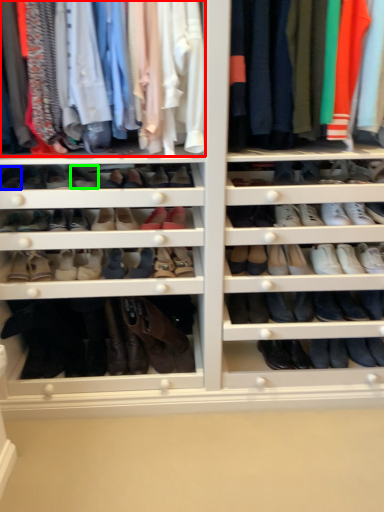
Question: Which is nearer to the clothing (highlighted by a red box)? shoe (highlighted by a blue box) or shoe (highlighted by a green box).

Choices:
 (A) shoe
 (B) shoe

Answer: (B)